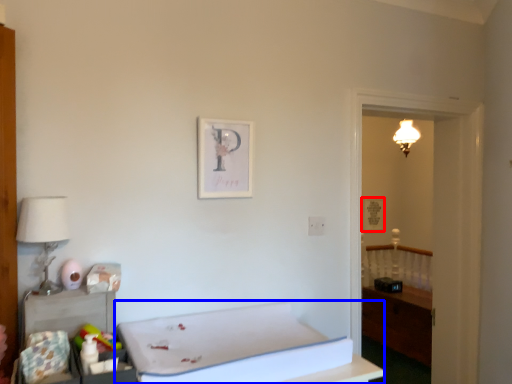
Question: Which of the following is the farthest to the observer, picture frame (highlighted by a red box) or furniture (highlighted by a blue box)?

Choices:
 (A) picture frame
 (B) furniture

Answer: (A)